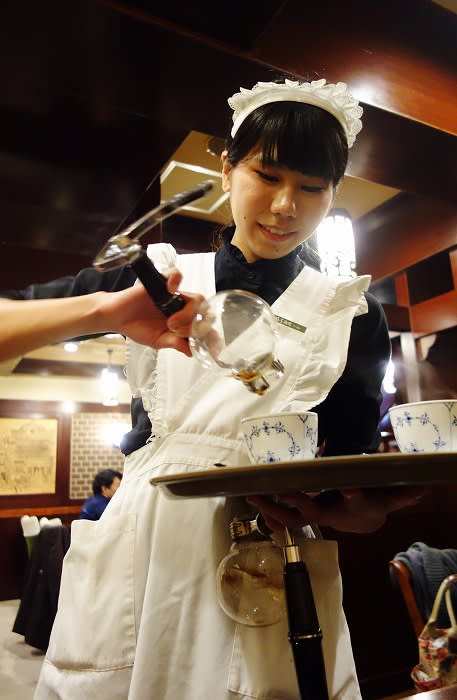
Locate an element on the screen. This screenshot has width=457, height=700. bowl is located at coordinates (280, 435).